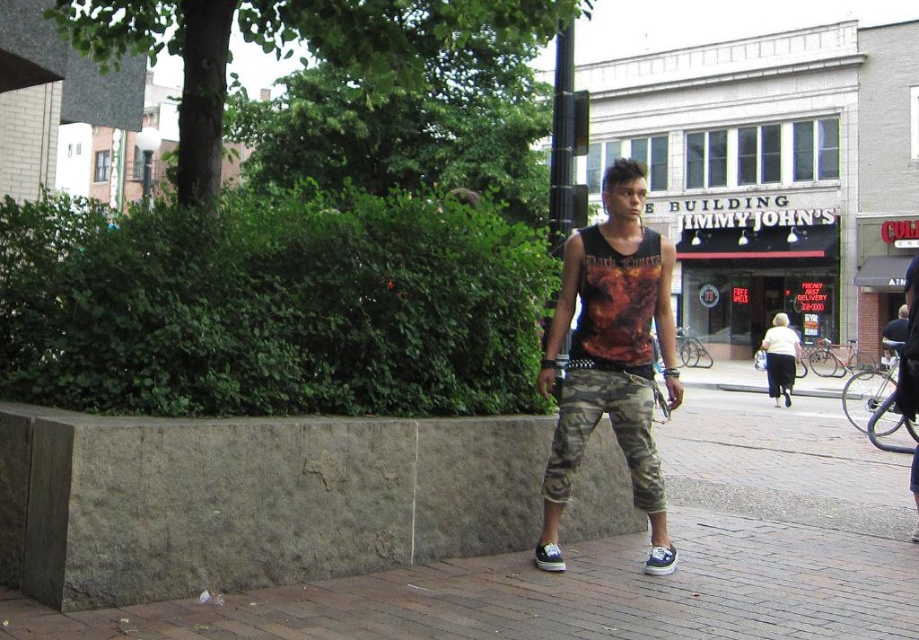
You are a delivery person standing on the gray concrete pavement at center. You need to deliver a package to the address located behind the low stone wall to the left. Can you walk straight from your current position to reach the wall?

The gray concrete pavement at center is located at point (623, 557). Since the low stone wall is to the left of your current position, you can walk straight towards the left to reach it.

You are a delivery drone operator trying to land your drone on the gray concrete pavement at center. Your drone has a height of 1.2 meters. Can the drone safely land there without hitting the printed fabric tank top at center?

The gray concrete pavement at center is much taller than the printed fabric tank top at center, so the drone can safely land there as the pavement is elevated enough to avoid collision with the tank top.